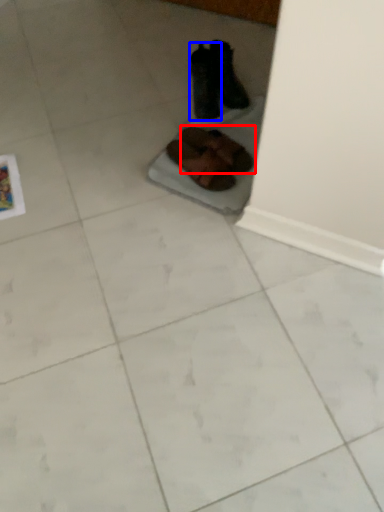
Question: Among these objects, which one is nearest to the camera, footwear (highlighted by a red box) or footwear (highlighted by a blue box)?

Choices:
 (A) footwear
 (B) footwear

Answer: (A)